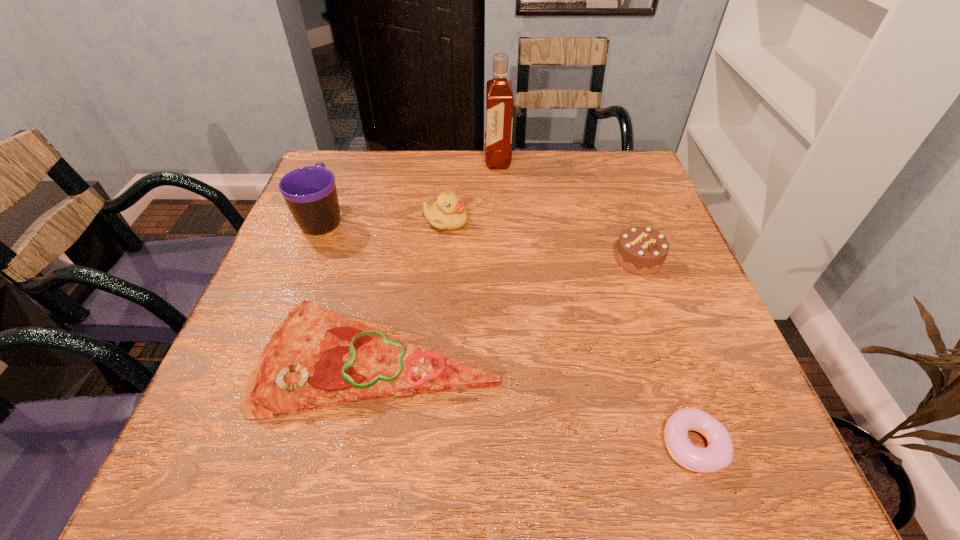
At what (x,y) coordinates should I click in order to perform the action: click on free space at the far left corner of the desktop. Please return your answer as a coordinate pair (x, y). This screenshot has height=540, width=960. Looking at the image, I should click on tap(351, 171).

Where is `vacant region at the far right corner`? vacant region at the far right corner is located at coordinates (627, 198).

You are a GUI agent. You are given a task and a screenshot of the screen. Output one action in this format:
    pyautogui.click(x=<x>, y=<y>)
    Task: Click on the empty space between the liquor and the shortest object
    This screenshot has height=540, width=960.
    Given the screenshot: What is the action you would take?
    pyautogui.click(x=595, y=302)

Locate an element on the screen. Image resolution: width=960 pixels, height=540 pixels. free space between the doughnut and the second tallest object is located at coordinates (509, 331).

Find the location of a particular element. vacant space that is in between the pizza and the shortest object is located at coordinates (538, 402).

Find the location of a particular element. The image size is (960, 540). free spot between the doughnut and the chocolate cake is located at coordinates (666, 352).

The height and width of the screenshot is (540, 960). Identify the location of vacant space that is in between the farthest object and the chocolate cake. (568, 210).

You are a GUI agent. You are given a task and a screenshot of the screen. Output one action in this format:
    pyautogui.click(x=<x>, y=<y>)
    Task: Click on the vacant space that is in between the shortest object and the second tallest object
    
    Given the screenshot: What is the action you would take?
    coord(509,331)

In order to click on blank region between the fourth farthest object and the shortest object in this screenshot , I will do `click(666, 352)`.

Where is `unoccupied position between the fifth tallest object and the second tallest object`? Image resolution: width=960 pixels, height=540 pixels. unoccupied position between the fifth tallest object and the second tallest object is located at coordinates (352, 288).